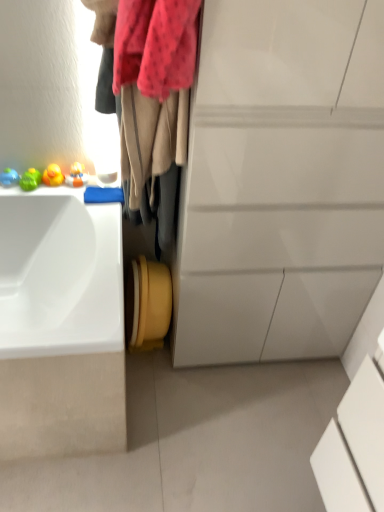
Find the location of `free location to the right of white glossy sink at left`. free location to the right of white glossy sink at left is located at coordinates (206, 426).